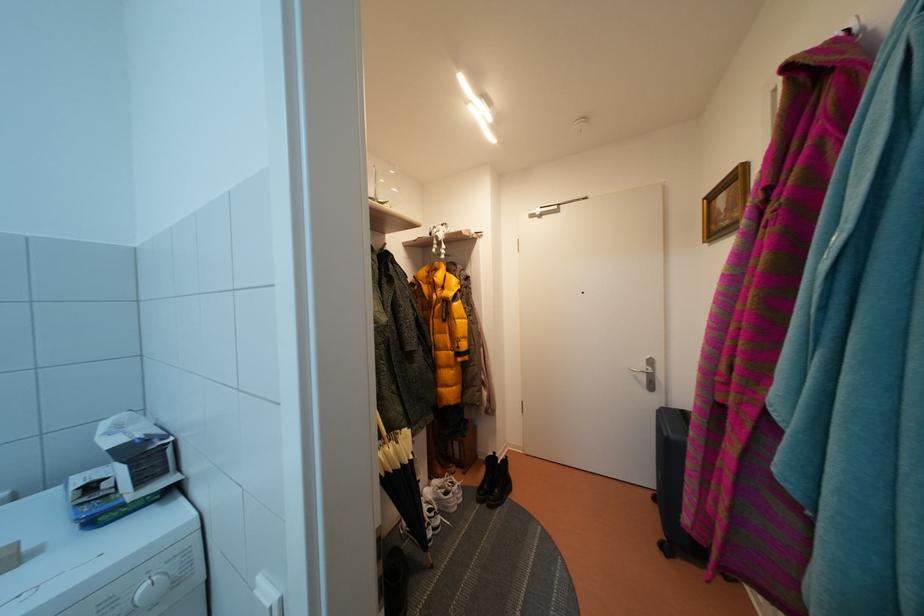
The location [487,477] corresponds to which object?

This point indicates the black boot.